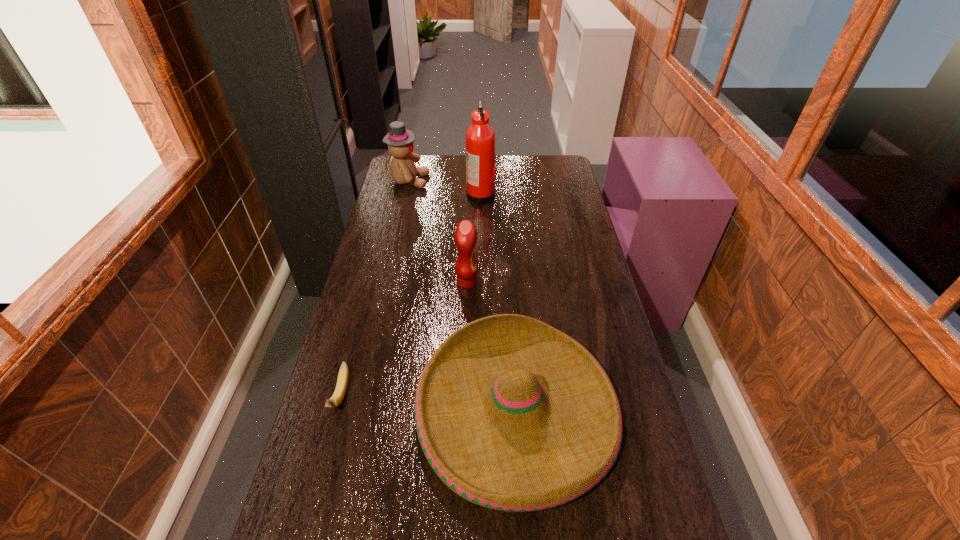
Find the location of a particular element. Image resolution: width=960 pixels, height=540 pixels. fire extinguisher is located at coordinates (480, 140).

Identify the location of rag_doll. (400, 141).

This screenshot has width=960, height=540. In order to click on condiment in this screenshot , I will do `click(465, 236)`.

You are a GUI agent. You are given a task and a screenshot of the screen. Output one action in this format:
    pyautogui.click(x=<x>, y=<y>)
    Task: Click on the sombrero
    This screenshot has width=960, height=540.
    Given the screenshot: What is the action you would take?
    pyautogui.click(x=512, y=414)

The width and height of the screenshot is (960, 540). Identify the location of the shortest object. (342, 381).

At what (x,y) coordinates should I click in order to perform the action: click on vacant area located on the label side of the fire extinguisher. Please return your answer as a coordinate pair (x, y). The height and width of the screenshot is (540, 960). Looking at the image, I should click on (416, 195).

Locate an element on the screen. The image size is (960, 540). vacant area located 0.050m on the label side of the fire extinguisher is located at coordinates (455, 195).

Find the location of a particular element. This screenshot has height=540, width=960. free space located 0.270m on the label side of the fire extinguisher is located at coordinates (407, 195).

In order to click on vacant region located 0.380m on the front-facing side of the rag_doll in this screenshot , I will do `click(509, 181)`.

Locate an element on the screen. This screenshot has height=540, width=960. vacant space located 0.250m on the label side of the third nearest object is located at coordinates (547, 282).